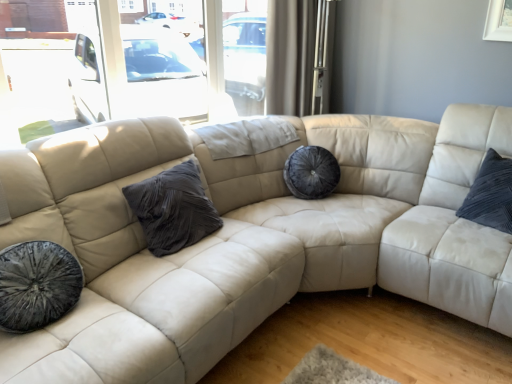
The height and width of the screenshot is (384, 512). Describe the element at coordinates (173, 209) in the screenshot. I see `velvet dark gray pillow at center` at that location.

What is the approximate width of velvet dark gray pillow at center?

velvet dark gray pillow at center is 10.57 inches in width.

Image resolution: width=512 pixels, height=384 pixels. I want to click on velvet dark gray pillow at center, so click(173, 209).

At what (x,y) coordinates should I click in order to perform the action: click on white sheer curtain at upper center. Please return your answer as a coordinate pair (x, y). This screenshot has height=384, width=512. Looking at the image, I should click on (290, 56).

What do you see at coordinates (290, 56) in the screenshot? I see `white sheer curtain at upper center` at bounding box center [290, 56].

Identify the location of velvet dark gray pillow at center. The width and height of the screenshot is (512, 384). (173, 209).

Considering the positions of objects white sheer curtain at upper center and velvet dark gray pillow at center in the image provided, who is more to the right, white sheer curtain at upper center or velvet dark gray pillow at center?

From the viewer's perspective, white sheer curtain at upper center appears more on the right side.

Between white sheer curtain at upper center and velvet dark gray pillow at center, which one is positioned behind?

white sheer curtain at upper center is further from the camera.

Considering the positions of points (270, 100) and (152, 210), is point (270, 100) farther from camera compared to point (152, 210)?

Yes, point (270, 100) is behind point (152, 210).

Based on the photo, from the image's perspective, is white sheer curtain at upper center located above velvet dark gray pillow at center?

Yes, from the image's perspective, white sheer curtain at upper center is above velvet dark gray pillow at center.

From a real-world perspective, is white sheer curtain at upper center physically above velvet dark gray pillow at center?

Yes, from a real-world perspective, white sheer curtain at upper center is over velvet dark gray pillow at center

In terms of width, does white sheer curtain at upper center look wider or thinner when compared to velvet dark gray pillow at center?

Clearly, white sheer curtain at upper center has less width compared to velvet dark gray pillow at center.

In terms of height, does white sheer curtain at upper center look taller or shorter compared to velvet dark gray pillow at center?

Clearly, white sheer curtain at upper center is taller compared to velvet dark gray pillow at center.

Does white sheer curtain at upper center have a larger size compared to velvet dark gray pillow at center?

Correct, white sheer curtain at upper center is larger in size than velvet dark gray pillow at center.

Would you say white sheer curtain at upper center is inside or outside velvet dark gray pillow at center?

white sheer curtain at upper center is not inside velvet dark gray pillow at center, it's outside.

Is white sheer curtain at upper center far from velvet dark gray pillow at center?

Absolutely, white sheer curtain at upper center is distant from velvet dark gray pillow at center.

Could you tell me if white sheer curtain at upper center is turned towards velvet dark gray pillow at center?

No, white sheer curtain at upper center does not turn towards velvet dark gray pillow at center.

Can you tell me how much white sheer curtain at upper center and velvet dark gray pillow at center differ in facing direction?

The facing directions of white sheer curtain at upper center and velvet dark gray pillow at center are 3.39 degrees apart.

Locate an element on the screen. The image size is (512, 384). pillow in front of the white sheer curtain at upper center is located at coordinates (173, 209).

Which is more to the right, velvet dark gray pillow at center or white sheer curtain at upper center?

From the viewer's perspective, white sheer curtain at upper center appears more on the right side.

Does velvet dark gray pillow at center come in front of white sheer curtain at upper center?

Yes, velvet dark gray pillow at center is closer to the camera.

Which point is more distant from viewer, [137,189] or [306,40]?

The point [306,40] is farther from the camera.

From the image's perspective, which is above, velvet dark gray pillow at center or white sheer curtain at upper center?

white sheer curtain at upper center is shown above in the image.

From a real-world perspective, is velvet dark gray pillow at center over white sheer curtain at upper center?

No.

Between velvet dark gray pillow at center and white sheer curtain at upper center, which one has smaller width?

white sheer curtain at upper center is thinner.

Does velvet dark gray pillow at center have a lesser height compared to white sheer curtain at upper center?

Yes, velvet dark gray pillow at center is shorter than white sheer curtain at upper center.

Considering the sizes of velvet dark gray pillow at center and white sheer curtain at upper center in the image, is velvet dark gray pillow at center bigger or smaller than white sheer curtain at upper center?

Considering their sizes, velvet dark gray pillow at center takes up less space than white sheer curtain at upper center.

Is velvet dark gray pillow at center completely or partially outside of white sheer curtain at upper center?

velvet dark gray pillow at center is positioned outside white sheer curtain at upper center.

Does velvet dark gray pillow at center touch white sheer curtain at upper center?

velvet dark gray pillow at center and white sheer curtain at upper center are not in contact.

Is velvet dark gray pillow at center positioned with its back to white sheer curtain at upper center?

velvet dark gray pillow at center is not turned away from white sheer curtain at upper center.

Can you tell me how much velvet dark gray pillow at center and white sheer curtain at upper center differ in facing direction?

There is a 3.39-degree angle between the facing directions of velvet dark gray pillow at center and white sheer curtain at upper center.

Measure the distance from velvet dark gray pillow at center to white sheer curtain at upper center.

velvet dark gray pillow at center and white sheer curtain at upper center are 1.27 meters apart from each other.

The image size is (512, 384). Find the location of `pillow below the white sheer curtain at upper center (from a real-world perspective)`. pillow below the white sheer curtain at upper center (from a real-world perspective) is located at coordinates (173, 209).

Where is `curtain above the velvet dark gray pillow at center (from a real-world perspective)`? This screenshot has width=512, height=384. curtain above the velvet dark gray pillow at center (from a real-world perspective) is located at coordinates (290, 56).

Where is `curtain lying above the velvet dark gray pillow at center (from the image's perspective)`? The height and width of the screenshot is (384, 512). curtain lying above the velvet dark gray pillow at center (from the image's perspective) is located at coordinates point(290,56).